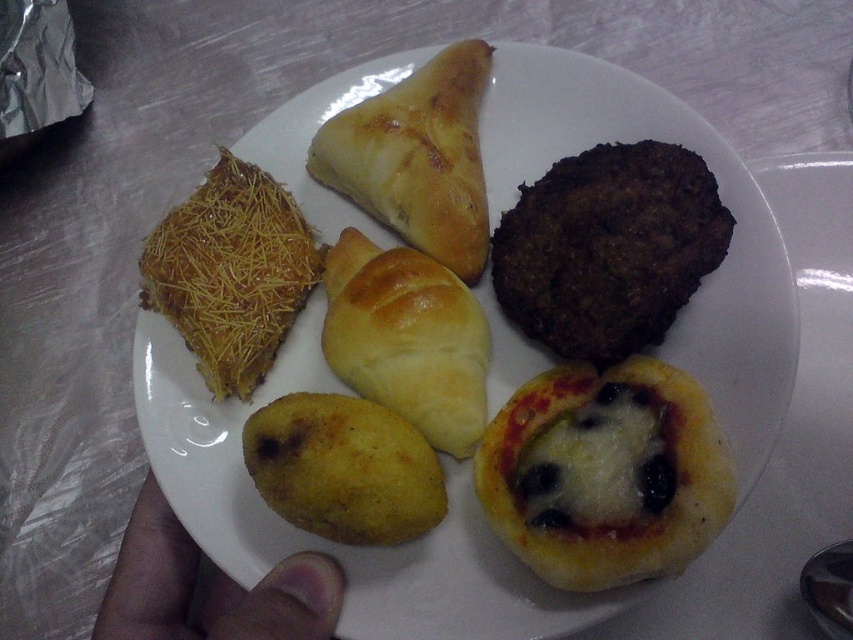
From the picture: Between cheesy pizza pocket at center and brown skin at lower left, which one is positioned higher?

cheesy pizza pocket at center is above.

Is cheesy pizza pocket at center positioned before brown skin at lower left?

Yes, cheesy pizza pocket at center is in front of brown skin at lower left.

At what (x,y) coordinates should I click in order to perform the action: click on cheesy pizza pocket at center. Please return your answer as a coordinate pair (x, y). The height and width of the screenshot is (640, 853). Looking at the image, I should click on (606, 474).

Can you confirm if golden crispy pastry at upper left is positioned to the left of brown skin at lower left?

In fact, golden crispy pastry at upper left is to the right of brown skin at lower left.

Can you confirm if golden crispy pastry at upper left is taller than brown skin at lower left?

Correct, golden crispy pastry at upper left is much taller as brown skin at lower left.

Find the location of a particular element. This screenshot has height=640, width=853. golden crispy pastry at upper left is located at coordinates (231, 273).

Is point (199, 506) less distant than point (154, 513)?

Yes, point (199, 506) is closer to viewer.

Does golden-brown crusty bread at upper center appear on the left side of brown skin at lower left?

No, golden-brown crusty bread at upper center is not to the left of brown skin at lower left.

Measure the distance between point (755, 372) and camera.

A distance of 3.28 feet exists between point (755, 372) and camera.

Find the location of a particular element. The height and width of the screenshot is (640, 853). golden-brown crusty bread at upper center is located at coordinates (325, 540).